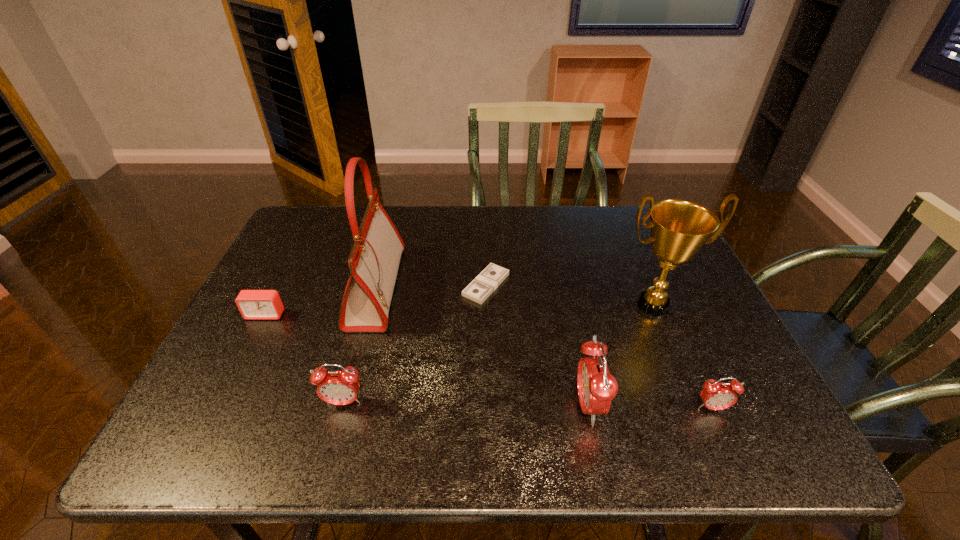
At what (x,y) coordinates should I click in order to perform the action: click on spot to insert another alarm_clock for uniform distribution. Please return your answer as a coordinate pair (x, y). Looking at the image, I should click on (x=466, y=404).